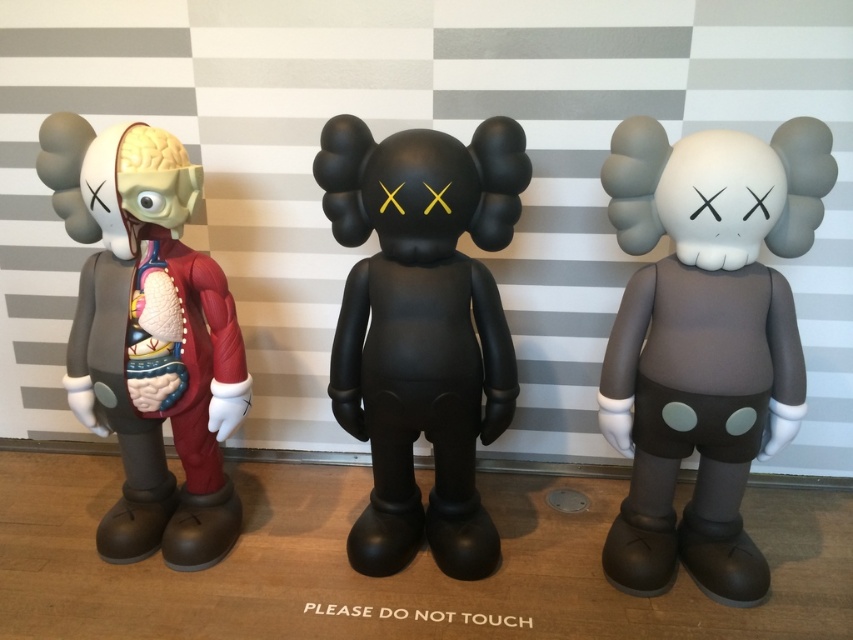
Question: Does matte gray figure at center appear on the right side of translucent red anatomical model at left?

Choices:
 (A) no
 (B) yes

Answer: (B)

Question: Is matte gray figure at center bigger than black matte/black rubber toy at center?

Choices:
 (A) no
 (B) yes

Answer: (A)

Question: Which point is farther to the camera?

Choices:
 (A) (734, 529)
 (B) (466, 221)
 (C) (109, 362)

Answer: (A)

Question: Which point is closer to the camera?

Choices:
 (A) black matte/black rubber toy at center
 (B) translucent red anatomical model at left
 (C) matte gray figure at center

Answer: (C)

Question: Which object appears farthest from the camera in this image?

Choices:
 (A) black matte/black rubber toy at center
 (B) matte gray figure at center
 (C) translucent red anatomical model at left

Answer: (C)

Question: Can you confirm if black matte/black rubber toy at center is positioned to the right of translucent red anatomical model at left?

Choices:
 (A) no
 (B) yes

Answer: (B)